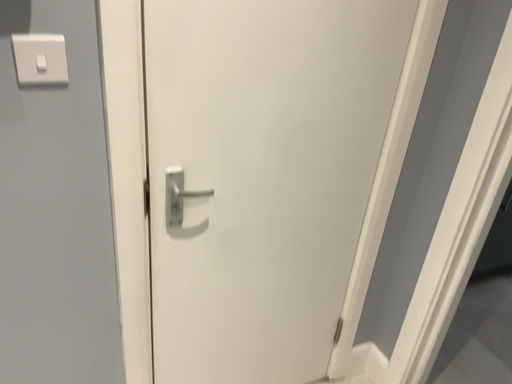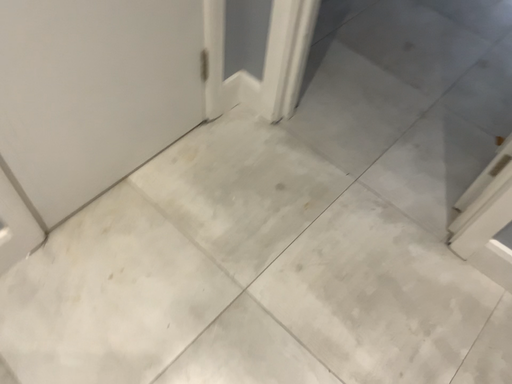
Question: Which way did the camera rotate in the video?

Choices:
 (A) rotated left
 (B) rotated right

Answer: (B)